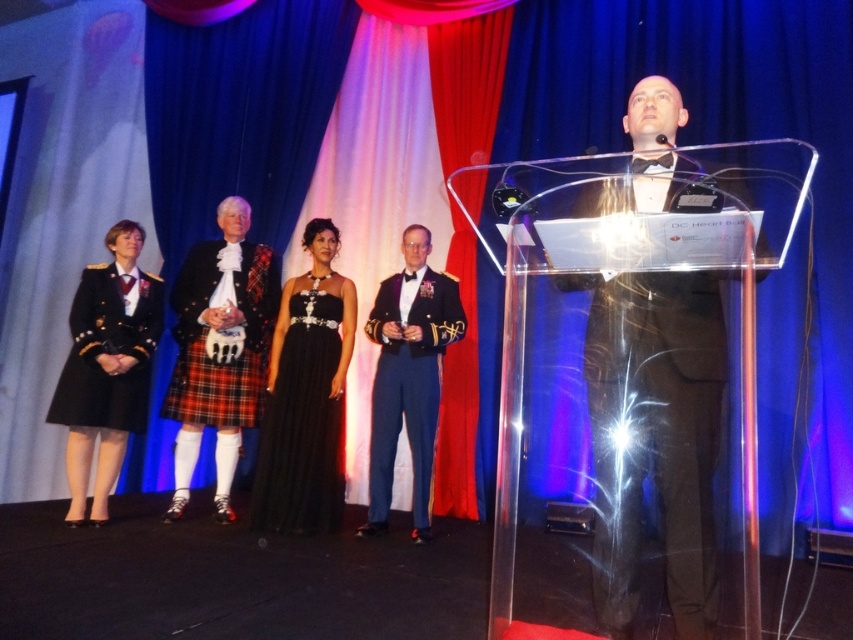
In the scene shown: You are sitting in the front row of the audience and want to hand a note to the person in the black tuxedo at center and the person in the red plaid kilt at center. Which one will be easier to reach?

The black tuxedo at center is closer to the viewer than the red plaid kilt at center, so it will be easier to reach the person in the black tuxedo at center.

You are an event planner observing the stage setup for the DC Heart Ball. You need to ensure that the black tuxedo at center and the red plaid kilt at center are positioned correctly according to the event theme. Based on their positions, which one is higher up on the stage?

The black tuxedo at center is above the red plaid kilt at center, so the black tuxedo at center is higher up on the stage.